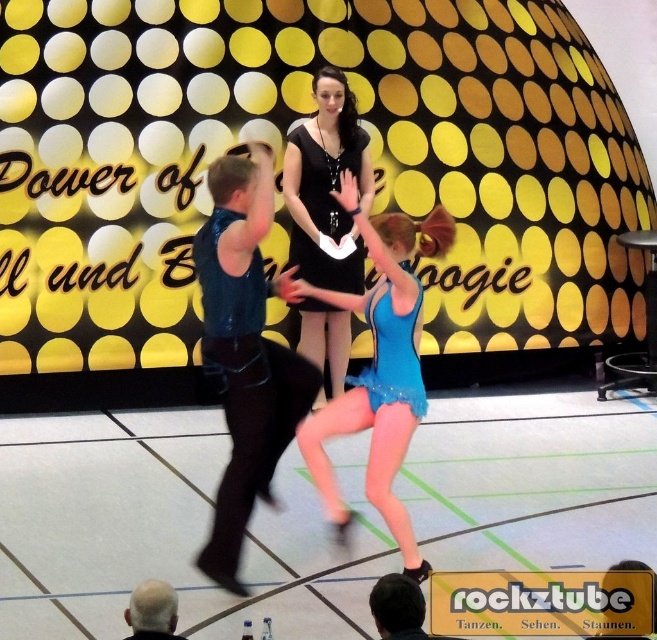
You are a photographer at the back of the stage. You want to take a photo of the shiny blue vest at center and the gray hair at lower left. Which object will appear larger in your photo?

The shiny blue vest at center will appear larger in the photo because it is bigger than the gray hair at lower left.